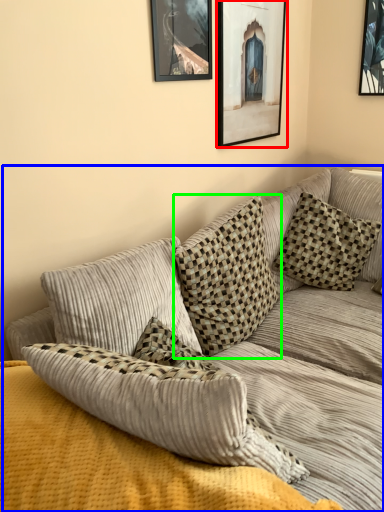
Question: Estimate the real-world distances between objects in this image. Which object is farther from picture frame (highlighted by a red box), studio couch (highlighted by a blue box) or pillow (highlighted by a green box)?

Choices:
 (A) studio couch
 (B) pillow

Answer: (A)